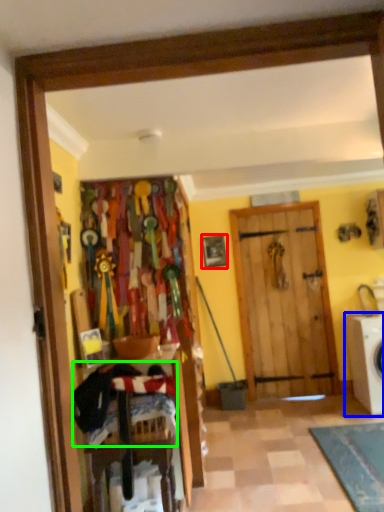
Question: Considering the real-world distances, which object is farthest from picture frame (highlighted by a red box)? washing machine (highlighted by a blue box) or laundry (highlighted by a green box)?

Choices:
 (A) washing machine
 (B) laundry

Answer: (B)